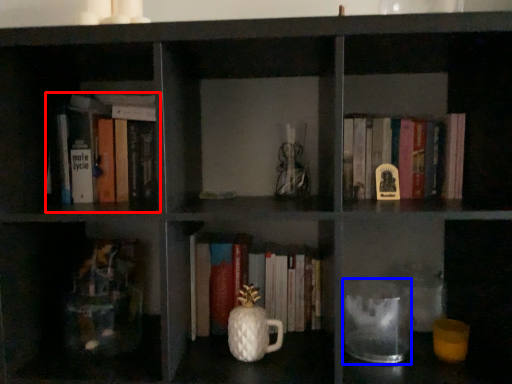
Question: Among these objects, which one is farthest to the camera, book (highlighted by a red box) or glass jar (highlighted by a blue box)?

Choices:
 (A) book
 (B) glass jar

Answer: (A)